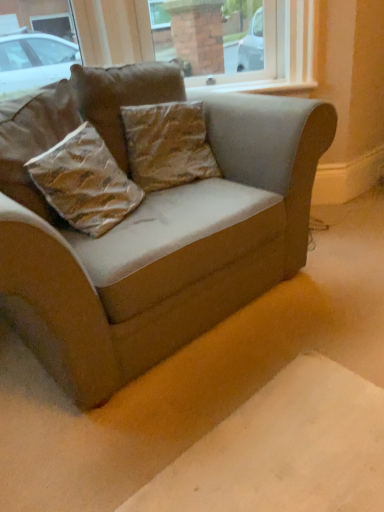
Question: Considering the relative sizes of brown textured pillow at center, acting as the third pillow starting from the top, and brown textured pillow at center, the 2th pillow from the top, in the image provided, is brown textured pillow at center, acting as the third pillow starting from the top, wider than brown textured pillow at center, the 2th pillow from the top,?

Choices:
 (A) no
 (B) yes

Answer: (B)

Question: Can you confirm if brown textured pillow at center, acting as the third pillow starting from the top, is smaller than brown textured pillow at center, which is counted as the 2th pillow, starting from the bottom?

Choices:
 (A) no
 (B) yes

Answer: (A)

Question: From the image's perspective, is brown textured pillow at center, acting as the third pillow starting from the top, located beneath brown textured pillow at center, the 2th pillow from the top?

Choices:
 (A) no
 (B) yes

Answer: (B)

Question: Is brown textured pillow at center, acting as the third pillow starting from the top, to the right of brown textured pillow at center, which is counted as the 2th pillow, starting from the bottom, from the viewer's perspective?

Choices:
 (A) yes
 (B) no

Answer: (B)

Question: From the image's perspective, is brown textured pillow at center, acting as the third pillow starting from the top, located above brown textured pillow at center, which is counted as the 2th pillow, starting from the bottom?

Choices:
 (A) yes
 (B) no

Answer: (B)

Question: In the image, is brown textured pillow at center, acting as the third pillow starting from the top, positioned in front of or behind brown textured pillow at center, which is counted as the 2th pillow, starting from the bottom?

Choices:
 (A) behind
 (B) front

Answer: (B)

Question: Based on their sizes in the image, would you say brown textured pillow at center, acting as the third pillow starting from the top, is bigger or smaller than brown textured pillow at center, which is counted as the 2th pillow, starting from the bottom?

Choices:
 (A) big
 (B) small

Answer: (A)

Question: Is brown textured pillow at center, the first pillow when ordered from bottom to top, taller or shorter than brown textured pillow at center, the 2th pillow from the top?

Choices:
 (A) tall
 (B) short

Answer: (B)

Question: Would you say brown textured pillow at center, acting as the third pillow starting from the top, is to the left or to the right of brown textured pillow at center, which is counted as the 2th pillow, starting from the bottom, in the picture?

Choices:
 (A) left
 (B) right

Answer: (A)

Question: From the image's perspective, is brown textured pillow at center, which is counted as the 2th pillow, starting from the bottom, located above or below velvet beige couch at center?

Choices:
 (A) above
 (B) below

Answer: (A)

Question: From their relative heights in the image, would you say brown textured pillow at center, the 2th pillow from the top, is taller or shorter than velvet beige couch at center?

Choices:
 (A) short
 (B) tall

Answer: (A)

Question: Relative to velvet beige couch at center, is brown textured pillow at center, which is counted as the 2th pillow, starting from the bottom, in front or behind?

Choices:
 (A) behind
 (B) front

Answer: (A)

Question: Is brown textured pillow at center, the 2th pillow from the top, wider or thinner than velvet beige couch at center?

Choices:
 (A) wide
 (B) thin

Answer: (B)

Question: Is brown textured pillow at center, the 3th pillow ordered from the bottom, taller or shorter than brown textured pillow at center, the 2th pillow from the top?

Choices:
 (A) short
 (B) tall

Answer: (B)

Question: In the image, is brown textured pillow at center, the 3th pillow ordered from the bottom, positioned in front of or behind brown textured pillow at center, which is counted as the 2th pillow, starting from the bottom?

Choices:
 (A) behind
 (B) front

Answer: (B)